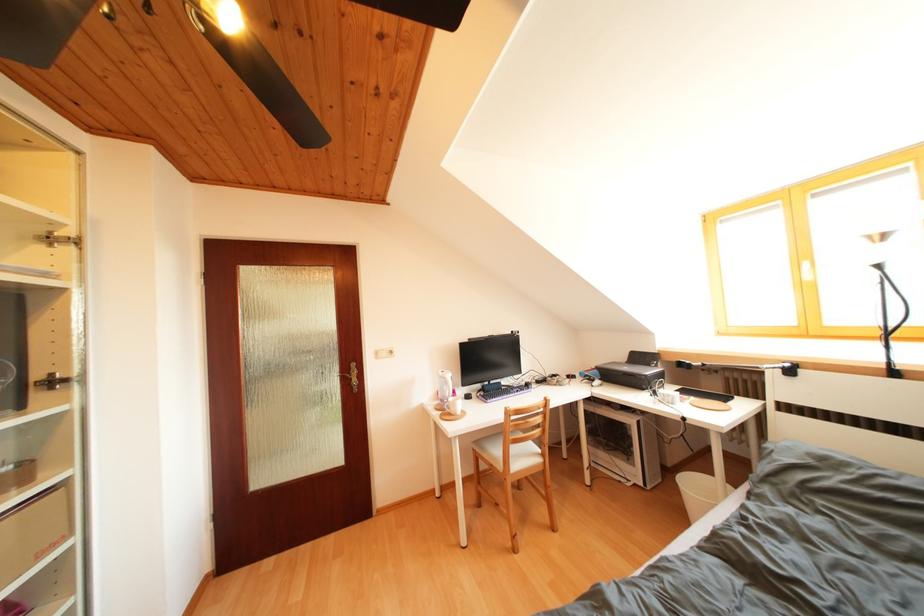
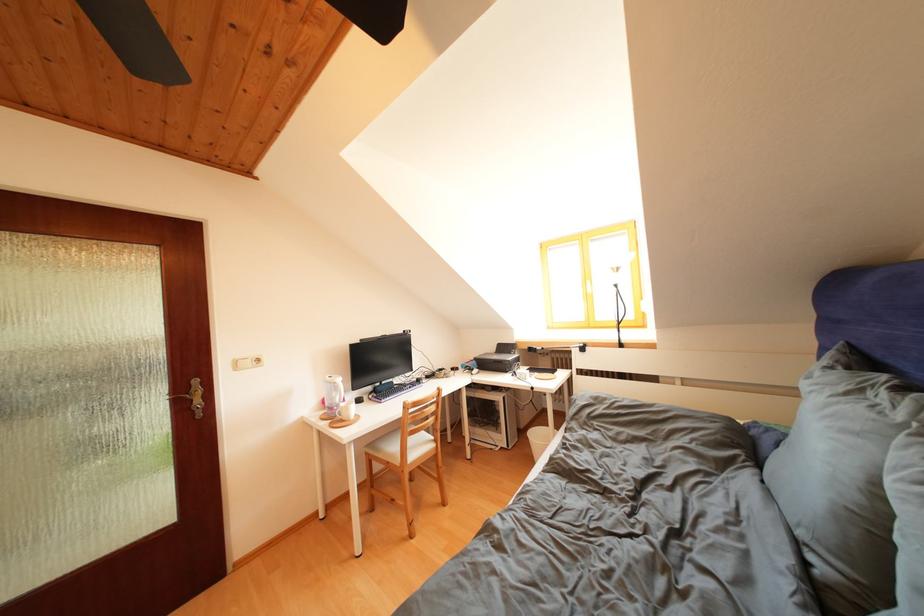
In the second image, find the point that corresponds to pixel 697 488 in the first image.

(542, 439)